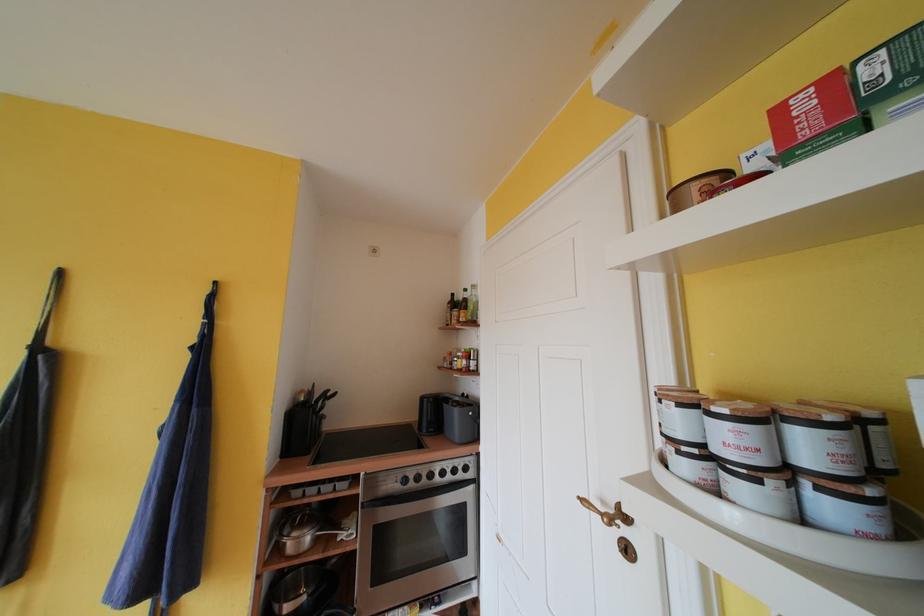
Where is `green glass bottle`? The height and width of the screenshot is (616, 924). green glass bottle is located at coordinates (472, 304).